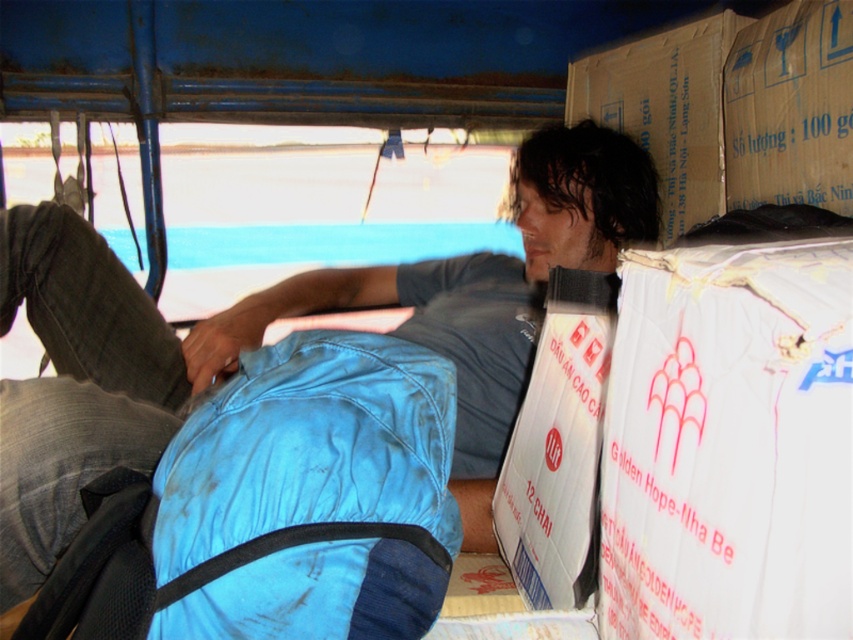
Does point (804, 44) come closer to viewer compared to point (677, 180)?

Yes.

Between cardboard box at upper right and brown cardboard box at upper right, which one has less height?

cardboard box at upper right

The width and height of the screenshot is (853, 640). I want to click on cardboard box at upper right, so (x=790, y=108).

Can you confirm if blue fabric sleeping bag at lower center is thinner than cardboard box at upper right?

No, blue fabric sleeping bag at lower center is not thinner than cardboard box at upper right.

From the picture: Who is shorter, blue fabric sleeping bag at lower center or cardboard box at upper right?

Standing shorter between the two is blue fabric sleeping bag at lower center.

Is point (155, 528) positioned after point (842, 70)?

That is False.

You are a GUI agent. You are given a task and a screenshot of the screen. Output one action in this format:
    pyautogui.click(x=<x>, y=<y>)
    Task: Click on the blue fabric sleeping bag at lower center
    
    Given the screenshot: What is the action you would take?
    pyautogui.click(x=310, y=448)

Does blue fabric sleeping bag at lower center have a larger size compared to brown cardboard box at upper right?

No, blue fabric sleeping bag at lower center is not bigger than brown cardboard box at upper right.

Between blue fabric sleeping bag at lower center and brown cardboard box at upper right, which one has less height?

blue fabric sleeping bag at lower center is shorter.

Is point (229, 531) less distant than point (726, 17)?

Yes, point (229, 531) is closer to viewer.

Where is `blue fabric sleeping bag at lower center`? The image size is (853, 640). blue fabric sleeping bag at lower center is located at coordinates (310, 448).